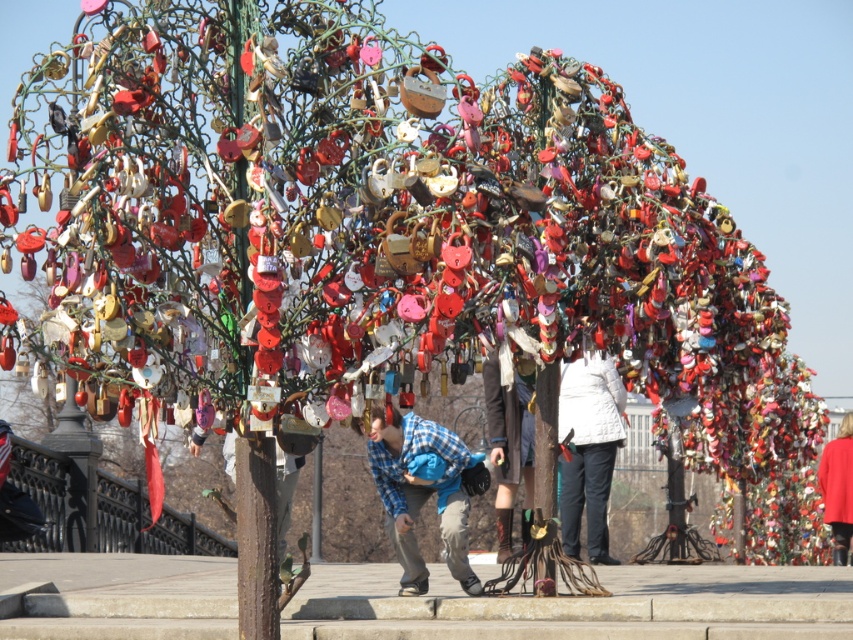
You are standing at the same location as the person in the blue plaid shirt and want to take a photo of both the point at coordinates point(614, 422) and point(840, 556). Which point should you focus on first to ensure both are in focus?

You should focus on point(614, 422) first because it is closer to the camera than point(840, 556). This ensures that both points will be within the depth of field when using a suitable aperture setting.